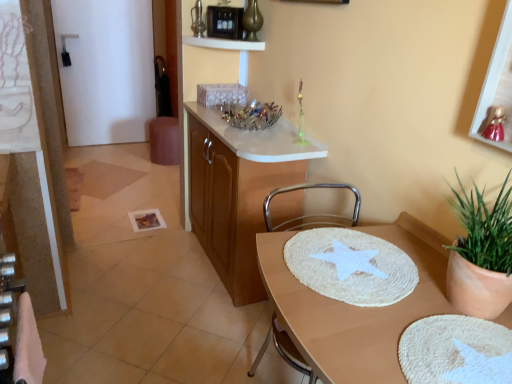
Question: Is gold metallic vase at upper center taller than black plastic microwave at upper center?

Choices:
 (A) no
 (B) yes

Answer: (B)

Question: Is gold metallic vase at upper center shorter than black plastic microwave at upper center?

Choices:
 (A) no
 (B) yes

Answer: (A)

Question: Is gold metallic vase at upper center positioned with its back to black plastic microwave at upper center?

Choices:
 (A) no
 (B) yes

Answer: (A)

Question: Can you confirm if gold metallic vase at upper center is bigger than black plastic microwave at upper center?

Choices:
 (A) no
 (B) yes

Answer: (B)

Question: From the image's perspective, is gold metallic vase at upper center above black plastic microwave at upper center?

Choices:
 (A) no
 (B) yes

Answer: (B)

Question: Considering the positions of point (308, 185) and point (234, 9), is point (308, 185) closer or farther from the camera than point (234, 9)?

Choices:
 (A) closer
 (B) farther

Answer: (A)

Question: From the image's perspective, is metallic silver chair at center above or below black plastic microwave at upper center?

Choices:
 (A) below
 (B) above

Answer: (A)

Question: Is metallic silver chair at center inside the boundaries of black plastic microwave at upper center, or outside?

Choices:
 (A) outside
 (B) inside

Answer: (A)

Question: In terms of height, does metallic silver chair at center look taller or shorter compared to black plastic microwave at upper center?

Choices:
 (A) tall
 (B) short

Answer: (A)

Question: From the image's perspective, relative to metallic gold picture frame at upper right, is wooden cabinet at center above or below?

Choices:
 (A) below
 (B) above

Answer: (A)

Question: Is point (223, 223) positioned closer to the camera than point (489, 59)?

Choices:
 (A) closer
 (B) farther

Answer: (B)

Question: Is wooden cabinet at center taller or shorter than metallic gold picture frame at upper right?

Choices:
 (A) tall
 (B) short

Answer: (A)

Question: From a real-world perspective, is wooden cabinet at center positioned above or below metallic gold picture frame at upper right?

Choices:
 (A) below
 (B) above

Answer: (A)

Question: In terms of height, does white glossy door at upper left look taller or shorter compared to white glossy shelf at upper center?

Choices:
 (A) short
 (B) tall

Answer: (B)

Question: In terms of size, does white glossy door at upper left appear bigger or smaller than white glossy shelf at upper center?

Choices:
 (A) small
 (B) big

Answer: (B)